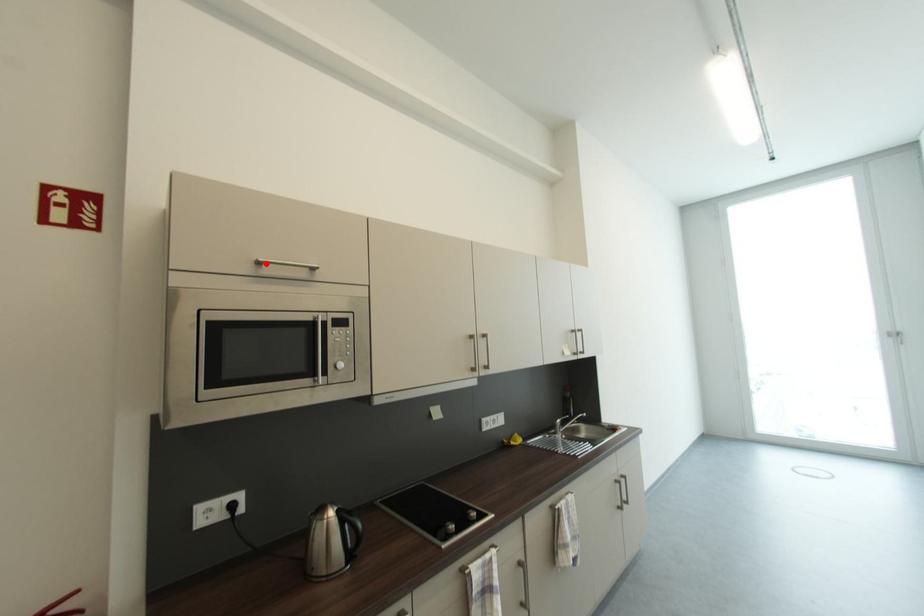
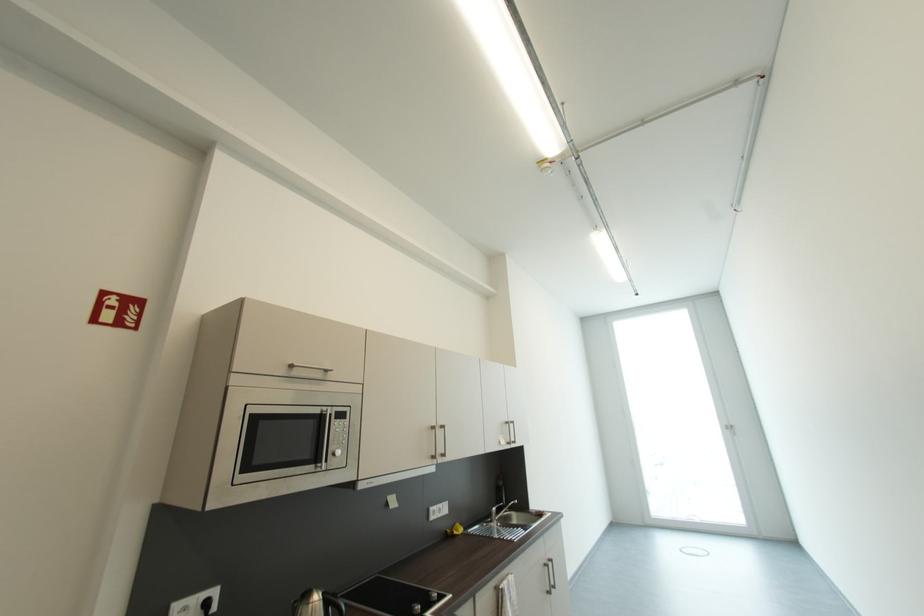
Where in the second image is the point corresponding to the highlighted location from the first image?

(298, 368)